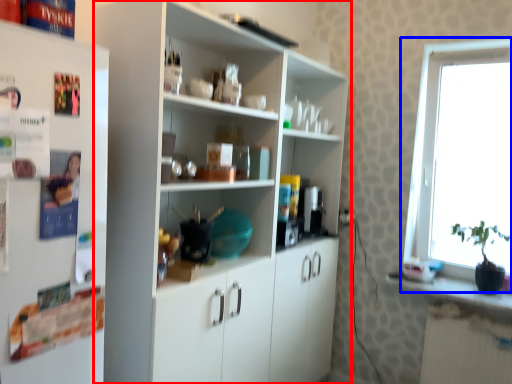
Question: Among these objects, which one is farthest to the camera, cupboard (highlighted by a red box) or window (highlighted by a blue box)?

Choices:
 (A) cupboard
 (B) window

Answer: (B)